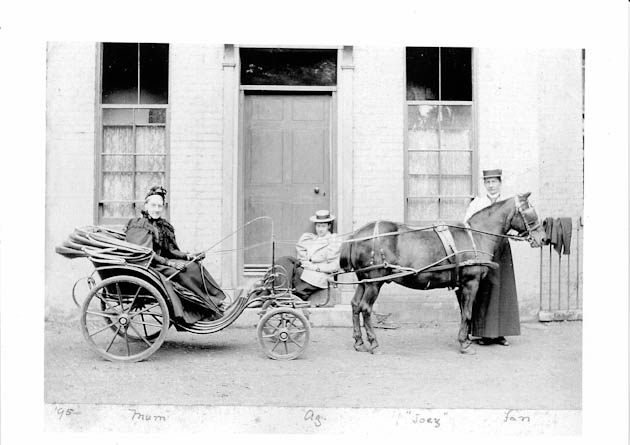
I want to click on switch, so click(207, 250), click(272, 218).